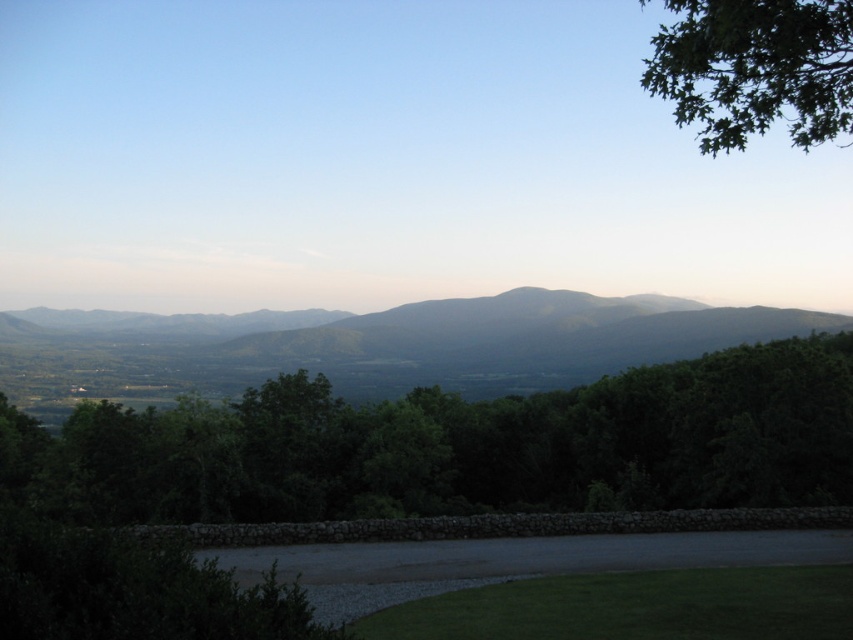
You are standing in the serene landscape scene. There are two points in the image, one at coordinate point (242, 508) and another at point (671, 298). Which point is nearer to you?

Point (242, 508) is closer to the viewer than point (671, 298).

You are standing at the center of the image and want to locate the green leafy tree at center. According to the coordinates provided, in which direction should you look to find it?

The green leafy tree at center is located at coordinates point (457, 445), which is slightly to the right and above the center point of the image. Therefore, you should look to the right and upwards from the center to find it.